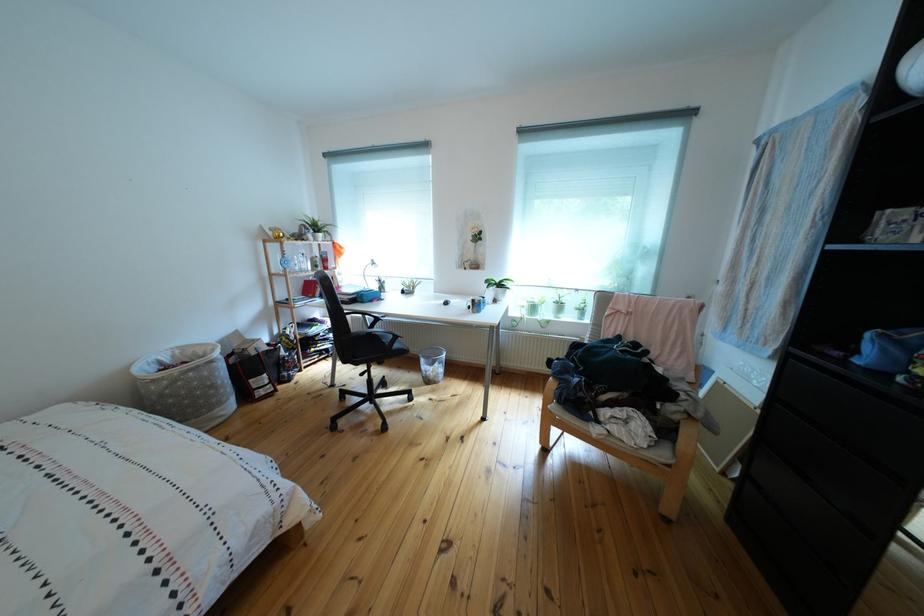
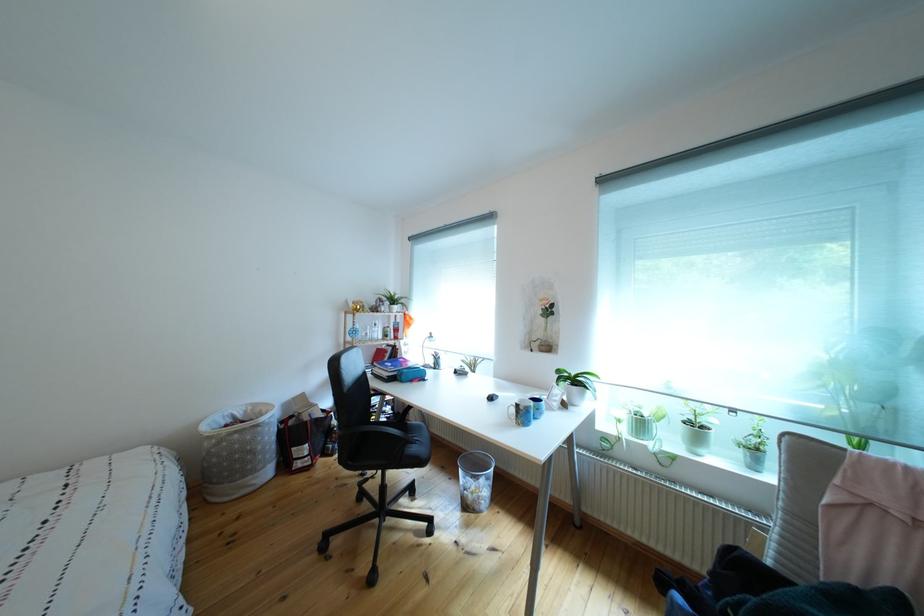
Where in the second image is the point corresponding to [224,392] from the first image?

(263, 456)